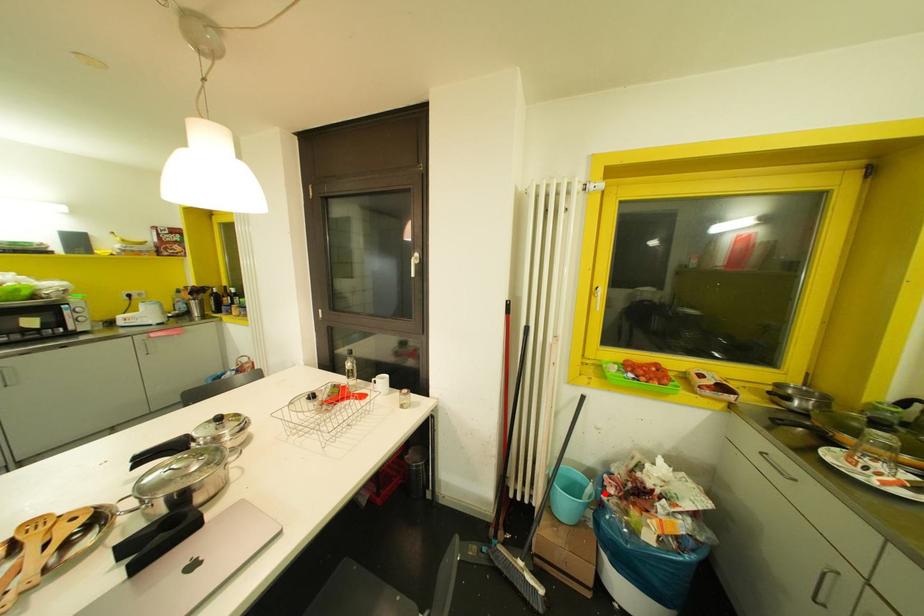
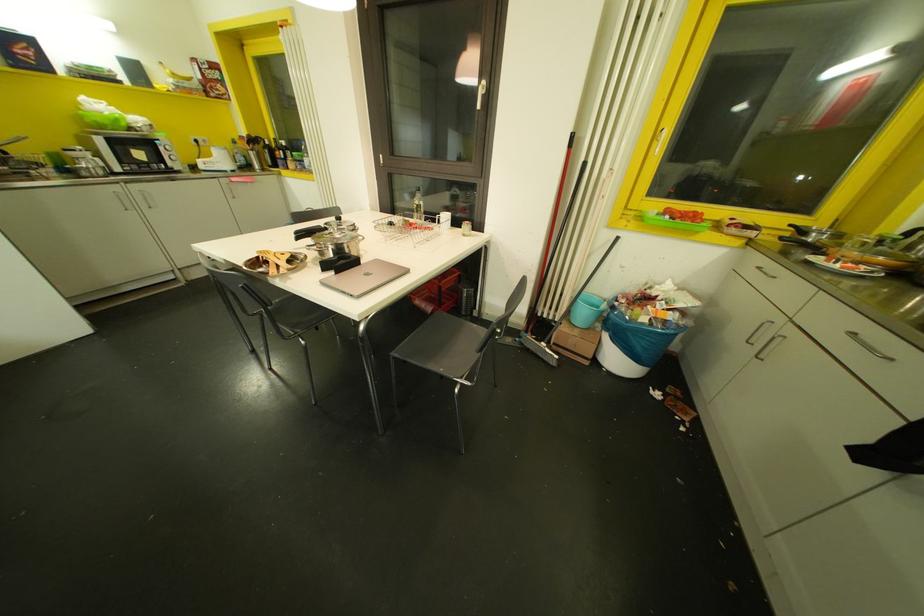
In the second image, find the point that corresponds to the highlighted location in the first image.

(614, 302)